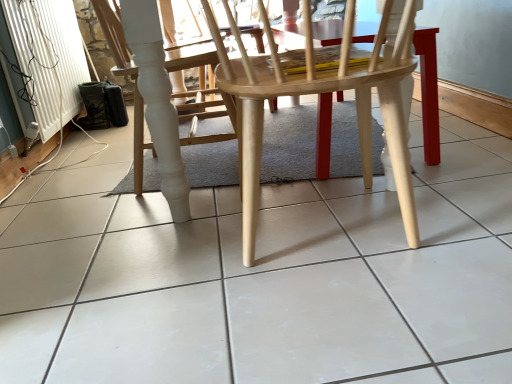
In order to face white glossy chair at center, arranged as the second chair when viewed from the front, should I rotate leftwards or rightwards?

Turn left approximately 11.462 degrees to face it.

Where is `natural wood chair at center, marked as the first chair in a right-to-left arrangement`? This screenshot has height=384, width=512. natural wood chair at center, marked as the first chair in a right-to-left arrangement is located at coordinates (319, 94).

Describe the element at coordinates (263, 277) in the screenshot. I see `white glossy tile at center` at that location.

In order to face white glossy tile at center, should I rotate leftwards or rightwards?

It's best to rotate left around 0.090 degrees.

Image resolution: width=512 pixels, height=384 pixels. In order to click on white textured radiator at lower left in this screenshot , I will do `click(34, 66)`.

At what (x,y) coordinates should I click in order to perform the action: click on white glossy chair at center, arranged as the second chair when viewed from the front. Please return your answer as a coordinate pair (x, y). Looking at the image, I should click on (114, 35).

Is white glossy tile at center positioned with its back to white glossy chair at center, which is the 1th chair in left-to-right order?

That's not correct — white glossy tile at center is not looking away from white glossy chair at center, which is the 1th chair in left-to-right order.

From the image's perspective, between white glossy tile at center and white glossy chair at center, arranged as the second chair when viewed from the front, which one is located above?

white glossy chair at center, arranged as the second chair when viewed from the front, is shown above in the image.

Does white glossy tile at center have a lesser width compared to white glossy chair at center, which is the 1th chair in left-to-right order?

No, white glossy tile at center is not thinner than white glossy chair at center, which is the 1th chair in left-to-right order.

Would you say white glossy tile at center is a long distance from white glossy chair at center, arranged as the second chair when viewed from the front?

That's not correct — white glossy tile at center is a little close to white glossy chair at center, arranged as the second chair when viewed from the front.

Who is bigger, natural wood chair at center, the first chair viewed from the front, or white glossy tile at center?

white glossy tile at center.

Is natural wood chair at center, placed as the second chair when sorted from back to front, to the left of white glossy tile at center from the viewer's perspective?

Incorrect, natural wood chair at center, placed as the second chair when sorted from back to front, is not on the left side of white glossy tile at center.

From their relative heights in the image, would you say natural wood chair at center, placed as the second chair when sorted from back to front, is taller or shorter than white glossy tile at center?

Clearly, natural wood chair at center, placed as the second chair when sorted from back to front, is taller compared to white glossy tile at center.

Is natural wood chair at center, marked as the first chair in a right-to-left arrangement, behind white glossy tile at center?

That is True.

Is natural wood chair at center, the first chair viewed from the front, spatially inside white glossy chair at center, which is the 1th chair in left-to-right order, or outside of it?

natural wood chair at center, the first chair viewed from the front, is not inside white glossy chair at center, which is the 1th chair in left-to-right order, it's outside.

From the image's perspective, relative to white glossy chair at center, the 2th chair in the right-to-left sequence, is natural wood chair at center, the first chair viewed from the front, above or below?

Based on their image positions, natural wood chair at center, the first chair viewed from the front, is located beneath white glossy chair at center, the 2th chair in the right-to-left sequence.

Between natural wood chair at center, the first chair viewed from the front, and white glossy chair at center, arranged as the second chair when viewed from the front, which one appears on the right side from the viewer's perspective?

natural wood chair at center, the first chair viewed from the front, is more to the right.

Is white textured radiator at lower left oriented away from white glossy tile at center?

No, white textured radiator at lower left is not facing away from white glossy tile at center.

From a real-world perspective, between white textured radiator at lower left and white glossy tile at center, who is vertically higher?

white textured radiator at lower left, from a real-world perspective.

Does white textured radiator at lower left have a lesser width compared to white glossy tile at center?

Yes.

Considering the positions of point (80, 79) and point (463, 129), is point (80, 79) closer or farther from the camera than point (463, 129)?

Point (80, 79) appears to be farther away from the viewer than point (463, 129).

Is there a large distance between white glossy chair at center, the 2th chair in the right-to-left sequence, and white textured radiator at lower left?

No, white glossy chair at center, the 2th chair in the right-to-left sequence, is not far away from white textured radiator at lower left.

Which chair is the 1st one when counting from the right side of the white textured radiator at lower left? Please provide its 2D coordinates.

[(114, 35)]

Can you confirm if white glossy chair at center, which is the 1th chair in left-to-right order, is taller than white textured radiator at lower left?

Yes.

Based on their sizes in the image, would you say white glossy chair at center, the first chair viewed from the back, is bigger or smaller than natural wood chair at center, marked as the first chair in a right-to-left arrangement?

Considering their sizes, white glossy chair at center, the first chair viewed from the back, takes up less space than natural wood chair at center, marked as the first chair in a right-to-left arrangement.

What's the angular difference between white glossy chair at center, the first chair viewed from the back, and natural wood chair at center, the second chair when ordered from left to right,'s facing directions?

white glossy chair at center, the first chair viewed from the back, and natural wood chair at center, the second chair when ordered from left to right, are facing 90 degrees away from each other.

Between white glossy chair at center, arranged as the second chair when viewed from the front, and natural wood chair at center, marked as the first chair in a right-to-left arrangement, which one is positioned in front?

natural wood chair at center, marked as the first chair in a right-to-left arrangement.

Which point is more distant from viewer, (242, 31) or (231, 93)?

The point (231, 93) is more distant.

What's the angular difference between white textured radiator at lower left and natural wood chair at center, marked as the first chair in a right-to-left arrangement,'s facing directions?

The angle between the facing direction of white textured radiator at lower left and the facing direction of natural wood chair at center, marked as the first chair in a right-to-left arrangement, is 90 degrees.

From a real-world perspective, which is physically below, white textured radiator at lower left or natural wood chair at center, the first chair viewed from the front?

From a 3D spatial view, natural wood chair at center, the first chair viewed from the front, is below.

Is white textured radiator at lower left far away from natural wood chair at center, marked as the first chair in a right-to-left arrangement?

Yes, white textured radiator at lower left and natural wood chair at center, marked as the first chair in a right-to-left arrangement, are located far from each other.

Which of these two, white textured radiator at lower left or natural wood chair at center, the first chair viewed from the front, is bigger?

natural wood chair at center, the first chair viewed from the front, is bigger.

At what (x,y) coordinates should I click in order to perform the action: click on ceramic tile on the right of white glossy chair at center, the first chair viewed from the back. Please return your answer as a coordinate pair (x, y). Looking at the image, I should click on (263, 277).

Locate an element on the screen. The width and height of the screenshot is (512, 384). ceramic tile located in front of the natural wood chair at center, the first chair viewed from the front is located at coordinates (263, 277).

From the image, which object appears to be farther from natural wood chair at center, marked as the first chair in a right-to-left arrangement, white textured radiator at lower left or white glossy chair at center, the first chair viewed from the back?

white textured radiator at lower left.

Estimate the real-world distances between objects in this image. Which object is further from white glossy tile at center, white textured radiator at lower left or white glossy chair at center, the 2th chair in the right-to-left sequence?

white textured radiator at lower left.

In the scene shown: Based on their spatial positions, is white glossy tile at center or white textured radiator at lower left further from white glossy chair at center, the first chair viewed from the back?

white textured radiator at lower left lies further to white glossy chair at center, the first chair viewed from the back, than the other object.

Based on their spatial positions, is natural wood chair at center, the first chair viewed from the front, or white glossy chair at center, the first chair viewed from the back, further from white glossy tile at center?

The object further to white glossy tile at center is white glossy chair at center, the first chair viewed from the back.

Based on their spatial positions, is white glossy tile at center or white glossy chair at center, the 2th chair in the right-to-left sequence, further from white textured radiator at lower left?

Based on the image, white glossy tile at center appears to be further to white textured radiator at lower left.

Which object lies nearer to the anchor point white textured radiator at lower left, natural wood chair at center, the first chair viewed from the front, or white glossy tile at center?

The object closer to white textured radiator at lower left is white glossy tile at center.

From the image, which object appears to be nearer to natural wood chair at center, the first chair viewed from the front, white glossy chair at center, the 2th chair in the right-to-left sequence, or white textured radiator at lower left?

The object closer to natural wood chair at center, the first chair viewed from the front, is white glossy chair at center, the 2th chair in the right-to-left sequence.

Looking at the image, which one is located further to white textured radiator at lower left, white glossy chair at center, arranged as the second chair when viewed from the front, or natural wood chair at center, the second chair when ordered from left to right?

Based on the image, natural wood chair at center, the second chair when ordered from left to right, appears to be further to white textured radiator at lower left.

At what (x,y) coordinates should I click in order to perform the action: click on chair between white glossy tile at center and white glossy chair at center, which is the 1th chair in left-to-right order, in the front-back direction. Please return your answer as a coordinate pair (x, y). Looking at the image, I should click on (319, 94).

The width and height of the screenshot is (512, 384). In order to click on chair situated between white textured radiator at lower left and natural wood chair at center, the first chair viewed from the front, from left to right in this screenshot , I will do tap(114, 35).

Locate an element on the screen. The image size is (512, 384). ceramic tile between white textured radiator at lower left and natural wood chair at center, placed as the second chair when sorted from back to front, in the horizontal direction is located at coordinates (263, 277).